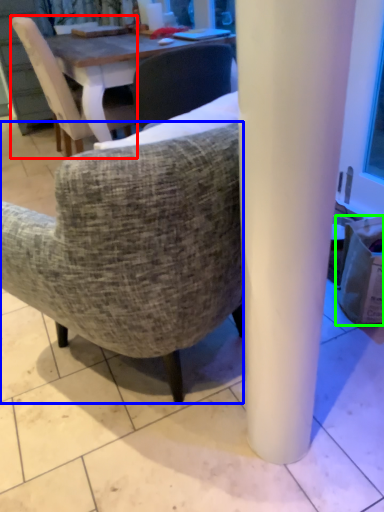
Question: Estimate the real-world distances between objects in this image. Which object is farther from chair (highlighted by a red box), chair (highlighted by a blue box) or trash bin/can (highlighted by a green box)?

Choices:
 (A) chair
 (B) trash bin/can

Answer: (B)